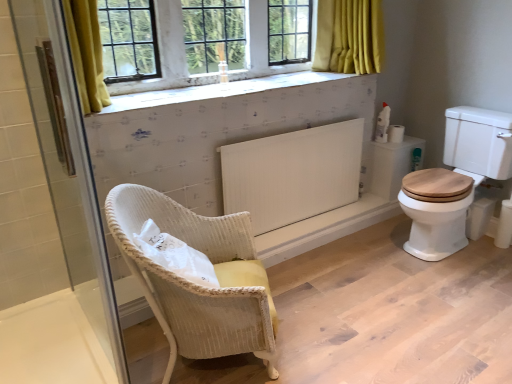
Question: In terms of width, does transparent glass shower door at left look wider or thinner when compared to woven yellow chair at center?

Choices:
 (A) wide
 (B) thin

Answer: (B)

Question: Based on their positions, is transparent glass shower door at left located to the left or right of woven yellow chair at center?

Choices:
 (A) left
 (B) right

Answer: (A)

Question: Which object is the farthest from the transparent glass shower door at left?

Choices:
 (A) white painted wood at upper center
 (B) white textured tile at upper center
 (C) white plastic spray bottle at upper right
 (D) woven yellow chair at center
 (E) white matte radiator at center

Answer: (C)

Question: Which of these objects is positioned closest to the white plastic spray bottle at upper right?

Choices:
 (A) white matte radiator at center
 (B) transparent glass shower door at left
 (C) white painted wood at upper center
 (D) white matte toilet paper at right
 (E) white textured tile at upper center

Answer: (D)